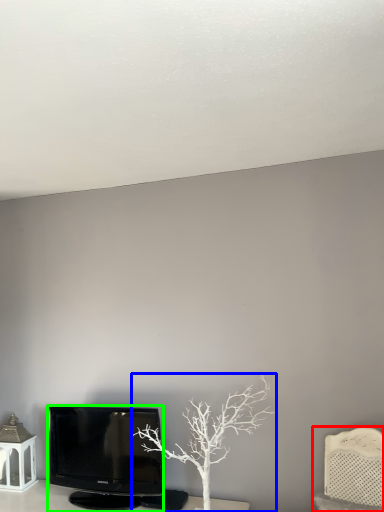
Question: Estimate the real-world distances between objects in this image. Which object is closer to furniture (highlighted by a red box), tree (highlighted by a blue box) or television (highlighted by a green box)?

Choices:
 (A) tree
 (B) television

Answer: (A)